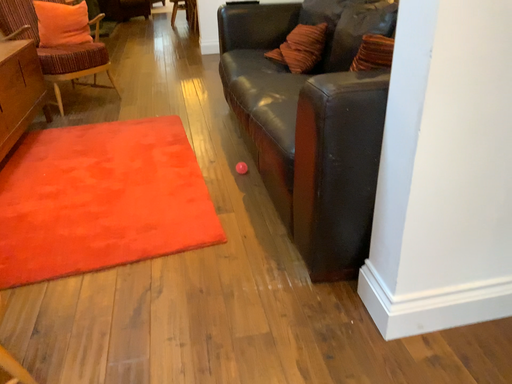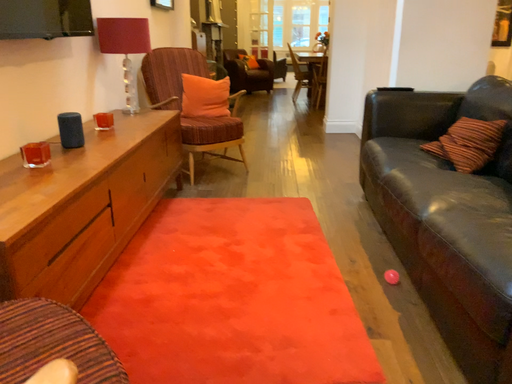
Question: Which way did the camera rotate in the video?

Choices:
 (A) rotated upward
 (B) rotated downward

Answer: (A)